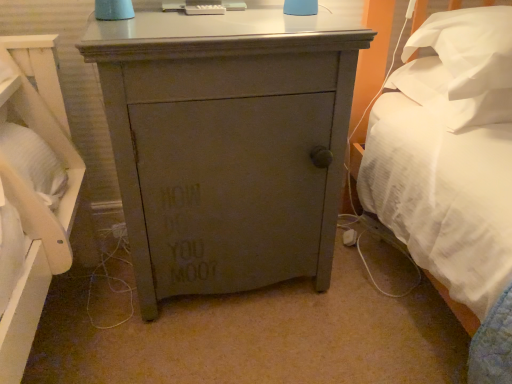
Question: Is matte gray cabinet at center situated inside white soft pillow at upper right, the 2th pillow when ordered from top to bottom, or outside?

Choices:
 (A) outside
 (B) inside

Answer: (A)

Question: From the image's perspective, is matte gray cabinet at center located above or below white soft pillow at upper right, the 1th pillow when ordered from bottom to top?

Choices:
 (A) below
 (B) above

Answer: (A)

Question: Which object is the farthest from the white soft pillow at upper right, the first pillow in the top-to-bottom sequence?

Choices:
 (A) white soft pillow at upper right, the 1th pillow when ordered from bottom to top
 (B) matte gray cabinet at center

Answer: (B)

Question: Which of these objects is positioned farthest from the white soft pillow at upper right, the 1th pillow when ordered from bottom to top?

Choices:
 (A) matte gray cabinet at center
 (B) white soft pillow at upper right, the first pillow in the top-to-bottom sequence

Answer: (A)